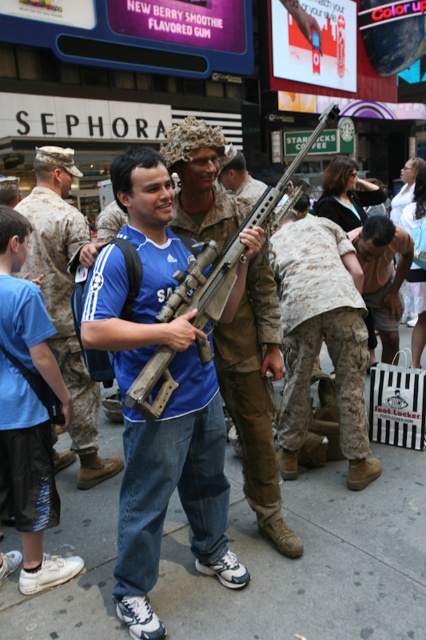
You are a photographer trying to capture a clear shot of the blue jersey at center and the camouflage fabric pants at center. Since the camera can only focus on one object at a time, which object should you focus on to ensure the other is in the background?

You should focus on the blue jersey at center because the camouflage fabric pants at center is positioned under it, meaning the pants are closer to the camera and the jersey is farther away. In photography, focusing on the farther object keeps the closer object in the background but still in focus, but since the camera can only focus on one, focusing on the pants would blur the jersey. Wait, actually, this might be incorrect. Let me think again. If the pants are under the jersey, they are behind the jersey,

You are a photographer setting up a shoot in the city. You have two items to place in the scene described. The matte black rifle at center and the black mesh shorts at lower left. According to the scene description, where should you position the matte black rifle relative to the black mesh shorts?

The matte black rifle at center should be positioned to the right of the black mesh shorts at lower left as per the description.

You are a delivery robot that is 1 meter wide. You need to move from the black mesh shorts at lower left to the camouflage uniform at center. Is there enough space between them for you to pass through?

The distance between the black mesh shorts at lower left and the camouflage uniform at center is 2.79 meters. Since the robot is 1 meter wide, there is sufficient space for it to pass through as the distance is greater than the robot width.